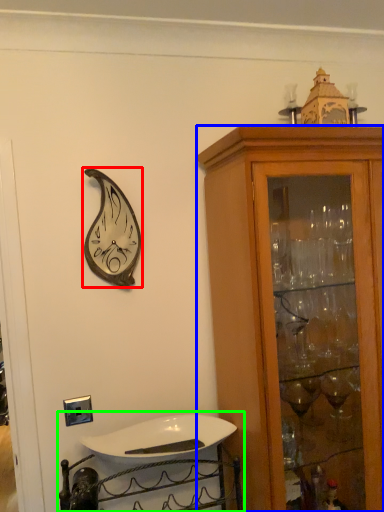
Question: Which is nearer to the clock (highlighted by a red box)? cabinetry (highlighted by a blue box) or sink (highlighted by a green box).

Choices:
 (A) cabinetry
 (B) sink

Answer: (A)